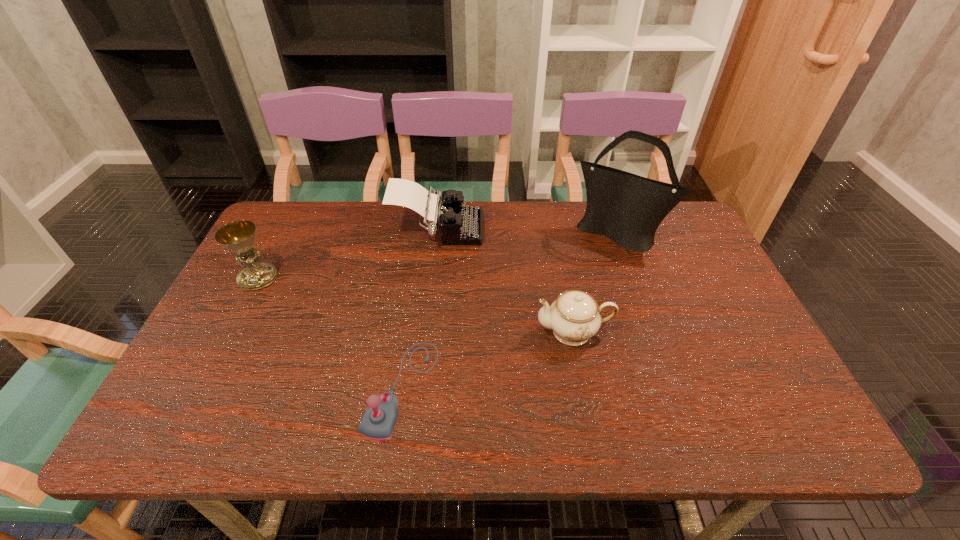
You are a GUI agent. You are given a task and a screenshot of the screen. Output one action in this format:
    pyautogui.click(x=<x>, y=<y>)
    Task: Click on the tallest object
    The height and width of the screenshot is (540, 960).
    Given the screenshot: What is the action you would take?
    pyautogui.click(x=627, y=208)

Identify the location of the third farthest object. This screenshot has width=960, height=540. (239, 236).

What are the coordinates of `the leftmost object` in the screenshot? It's located at (239, 236).

At what (x,y) coordinates should I click in order to perform the action: click on typewriter. Please return your answer as a coordinate pair (x, y). Image resolution: width=960 pixels, height=540 pixels. Looking at the image, I should click on (459, 225).

What are the coordinates of `chinaware` in the screenshot? It's located at (574, 317).

Locate an element on the screen. Image resolution: width=960 pixels, height=540 pixels. the shortest object is located at coordinates (379, 420).

Identify the location of vacant space situated on the front of the tallest object. (659, 348).

Find the location of a particular element. This screenshot has height=540, width=960. free space located 0.290m on the front of the third nearest object is located at coordinates (203, 384).

This screenshot has width=960, height=540. I want to click on free space located on the keys of the typewriter, so click(543, 230).

Locate an element on the screen. blank space located at the spout of the chinaware is located at coordinates (397, 332).